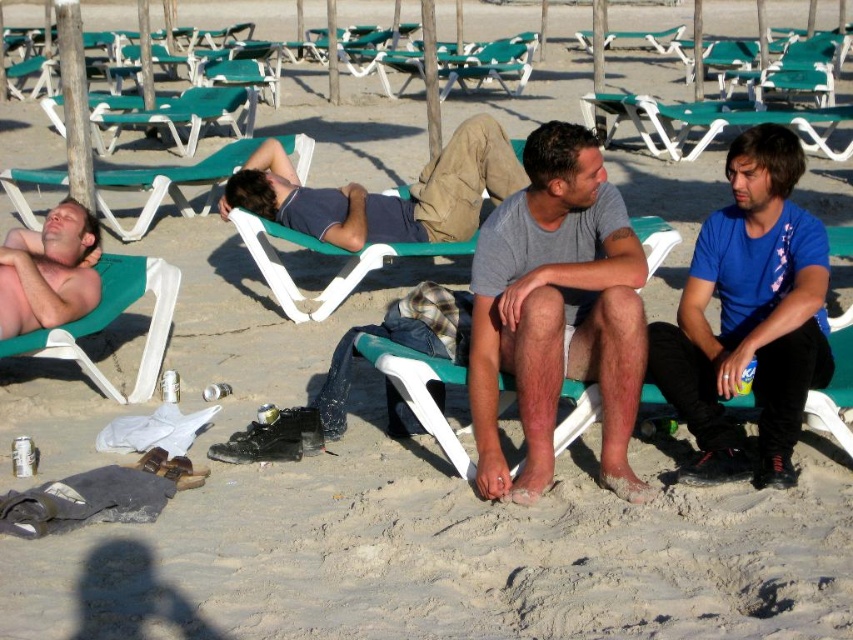
Question: Considering the real-world distances, which object is farthest from the shiny skin at left?

Choices:
 (A) matte blue shirt at center
 (B) gray matte shirt at center

Answer: (B)

Question: Which point is farther from the camera taking this photo?

Choices:
 (A) (155, 358)
 (B) (730, 141)
 (C) (672, 40)

Answer: (C)

Question: Does green plastic lounge chair at upper left have a lesser width compared to green plastic lounge chair at center?

Choices:
 (A) yes
 (B) no

Answer: (A)

Question: Does green plastic lounge chair at upper left appear on the left side of green plastic lounge chair at center?

Choices:
 (A) no
 (B) yes

Answer: (B)

Question: Considering the real-world distances, which object is closest to the green plastic beach chair at left?

Choices:
 (A) shiny skin at left
 (B) matte blue shirt at center

Answer: (A)

Question: From the image, what is the correct spatial relationship of shiny skin at left in relation to green plastic beach chair at left?

Choices:
 (A) above
 (B) below

Answer: (A)